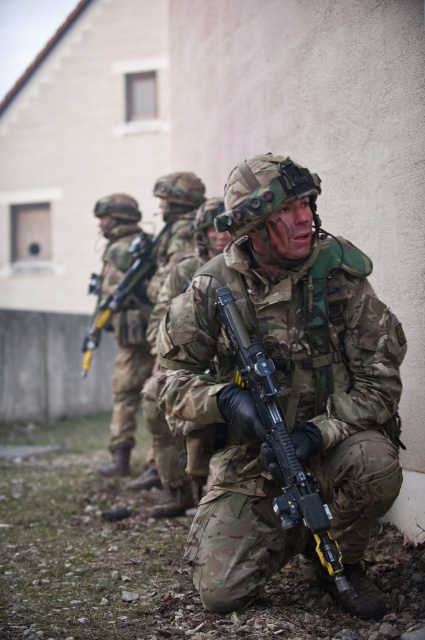
Question: Which point is farther to the camera?

Choices:
 (A) camouflage-patterned rifle at center
 (B) camouflage fabric rifle at center

Answer: (B)

Question: Is camouflage fabric uniform at center thinner than camouflage-patterned rifle at center?

Choices:
 (A) no
 (B) yes

Answer: (A)

Question: Is camouflage fabric rifle at center positioned before camouflage fabric uniform at center?

Choices:
 (A) yes
 (B) no

Answer: (A)

Question: Which object is positioned farthest from the camouflage-patterned rifle at center?

Choices:
 (A) camouflage fabric rifle at center
 (B) camouflage fabric uniform at center

Answer: (B)

Question: Can you confirm if camouflage fabric uniform at center is positioned below camouflage-patterned rifle at center?

Choices:
 (A) no
 (B) yes

Answer: (A)

Question: Which point is farther from the camera taking this photo?

Choices:
 (A) (135, 317)
 (B) (356, 560)
 (C) (235, 320)

Answer: (A)